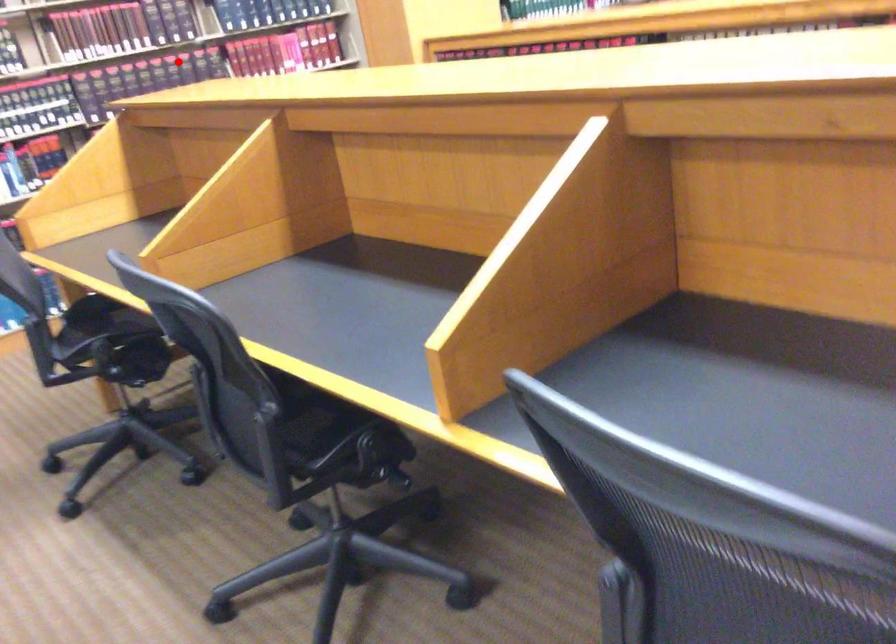
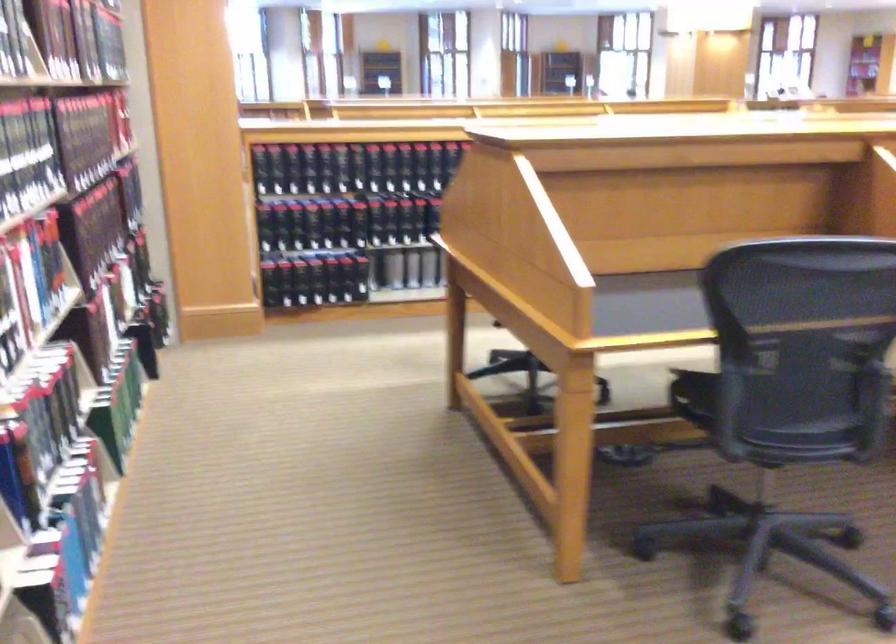
Question: I am providing you with two images of the same scene from different viewpoints. A red point is marked on the first image. Is the red point's position out of view in image 2?

Choices:
 (A) Yes
 (B) No

Answer: (A)